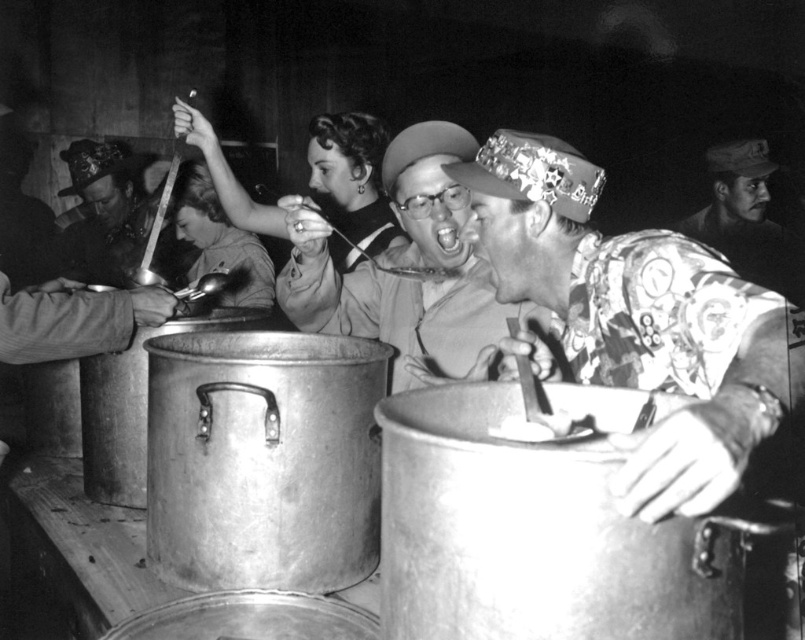
Question: Estimate the real-world distances between objects in this image. Which object is closer to the camouflage-patterned shirt at center?

Choices:
 (A) metallic silver spoon at center
 (B) smooth black hair at upper center

Answer: (B)

Question: Is metallic silver spoon at center to the left of camouflage-patterned shirt at center from the viewer's perspective?

Choices:
 (A) yes
 (B) no

Answer: (A)

Question: Can you confirm if shiny silver spoon at left is thinner than smooth skin face at center?

Choices:
 (A) yes
 (B) no

Answer: (B)

Question: Considering the real-world distances, which object is closest to the printed fabric shirt at center?

Choices:
 (A) smooth skin face at center
 (B) shiny silver spoon at left
 (C) metallic silver spoon at center

Answer: (C)

Question: Can you confirm if printed fabric shirt at center is positioned to the left of shiny silver spoon at left?

Choices:
 (A) yes
 (B) no

Answer: (B)

Question: Based on their relative distances, which object is nearer to the camouflage-patterned shirt at center?

Choices:
 (A) printed fabric shirt at center
 (B) smooth black hair at upper center
 (C) smooth skin face at center

Answer: (B)